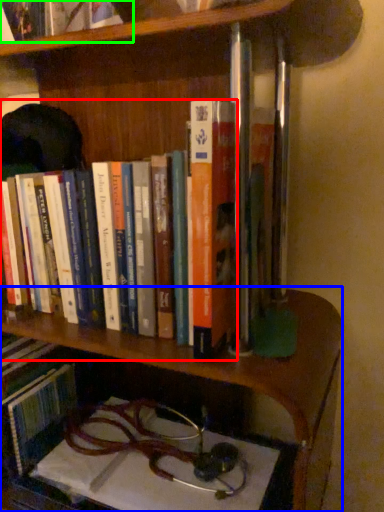
Question: Which is farther away from book (highlighted by a red box)? shelf (highlighted by a blue box) or book (highlighted by a green box)?

Choices:
 (A) shelf
 (B) book

Answer: (B)